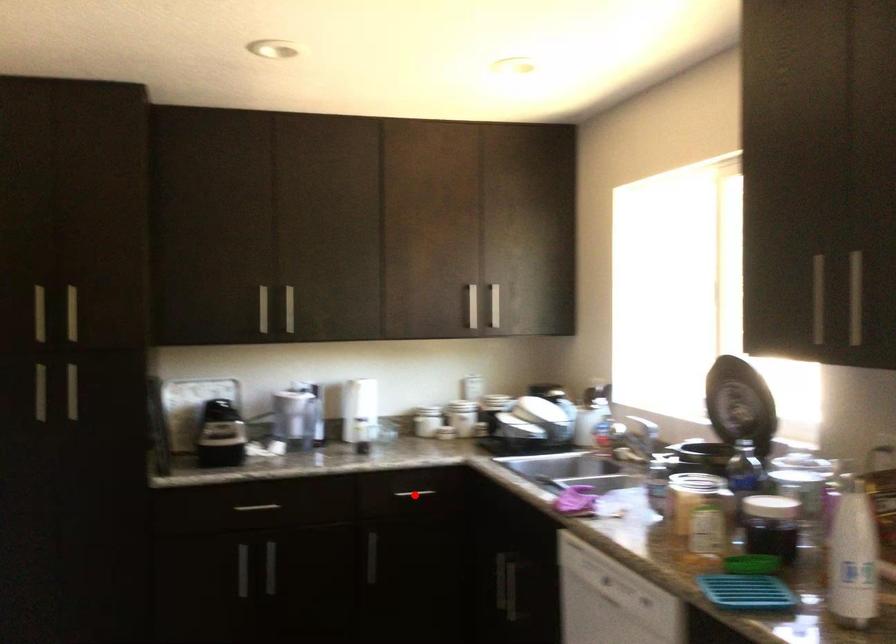
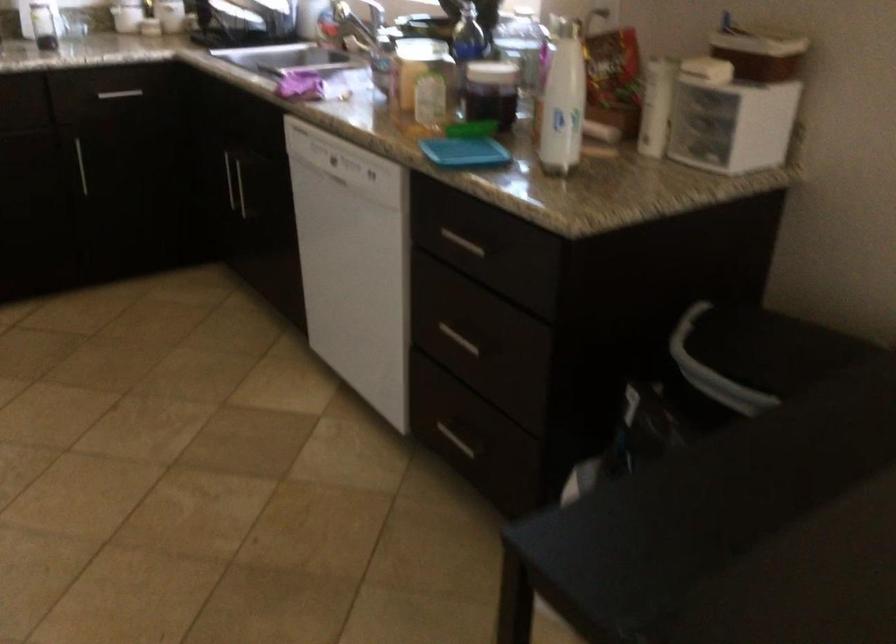
The point at the highlighted location is marked in the first image. Where is the corresponding point in the second image?

(119, 93)